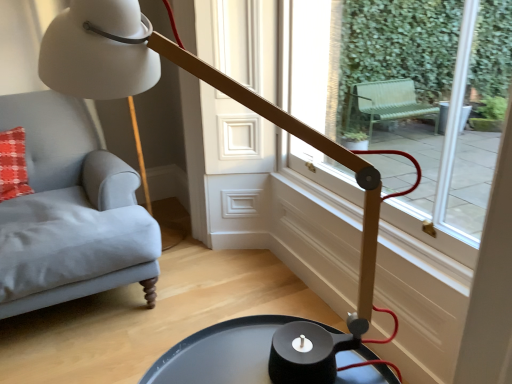
Question: Does black matte tray at lower center contain transparent glass window at center?

Choices:
 (A) no
 (B) yes

Answer: (A)

Question: Does black matte tray at lower center have a larger size compared to transparent glass window at center?

Choices:
 (A) yes
 (B) no

Answer: (B)

Question: Does black matte tray at lower center appear on the left side of transparent glass window at center?

Choices:
 (A) no
 (B) yes

Answer: (B)

Question: Could you tell me if black matte tray at lower center is facing transparent glass window at center?

Choices:
 (A) yes
 (B) no

Answer: (B)

Question: Does black matte tray at lower center touch transparent glass window at center?

Choices:
 (A) yes
 (B) no

Answer: (B)

Question: Is black matte tray at lower center positioned with its back to transparent glass window at center?

Choices:
 (A) yes
 (B) no

Answer: (B)

Question: Is transparent glass window at center shorter than black matte tray at lower center?

Choices:
 (A) no
 (B) yes

Answer: (A)

Question: From a real-world perspective, is transparent glass window at center below black matte tray at lower center?

Choices:
 (A) yes
 (B) no

Answer: (B)

Question: Would you say transparent glass window at center contains black matte tray at lower center?

Choices:
 (A) no
 (B) yes

Answer: (A)

Question: Is transparent glass window at center outside black matte tray at lower center?

Choices:
 (A) yes
 (B) no

Answer: (A)

Question: Is transparent glass window at center placed right next to black matte tray at lower center?

Choices:
 (A) no
 (B) yes

Answer: (A)

Question: Does transparent glass window at center lie in front of black matte tray at lower center?

Choices:
 (A) no
 (B) yes

Answer: (A)

Question: Looking at the image, does black matte tray at lower center seem bigger or smaller compared to transparent glass window at center?

Choices:
 (A) small
 (B) big

Answer: (A)